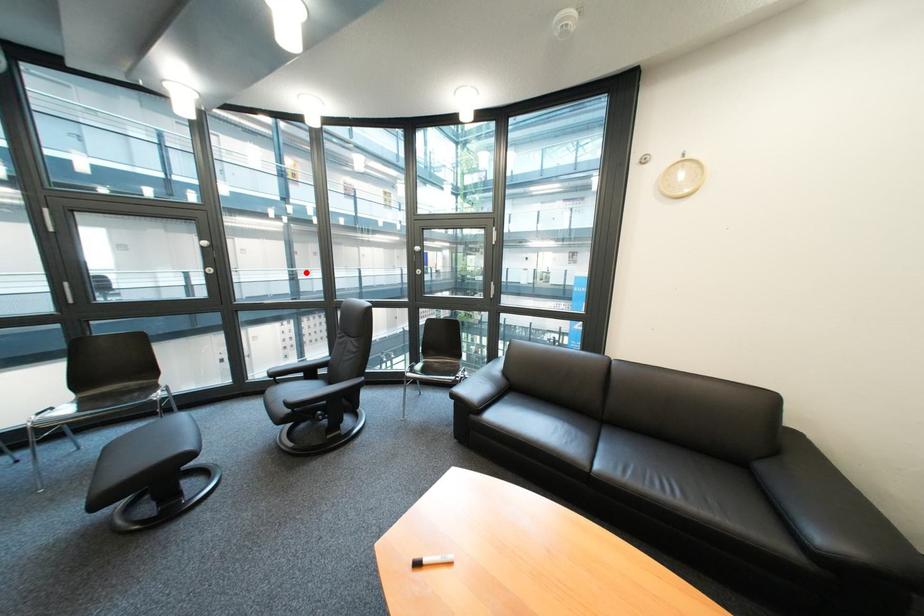
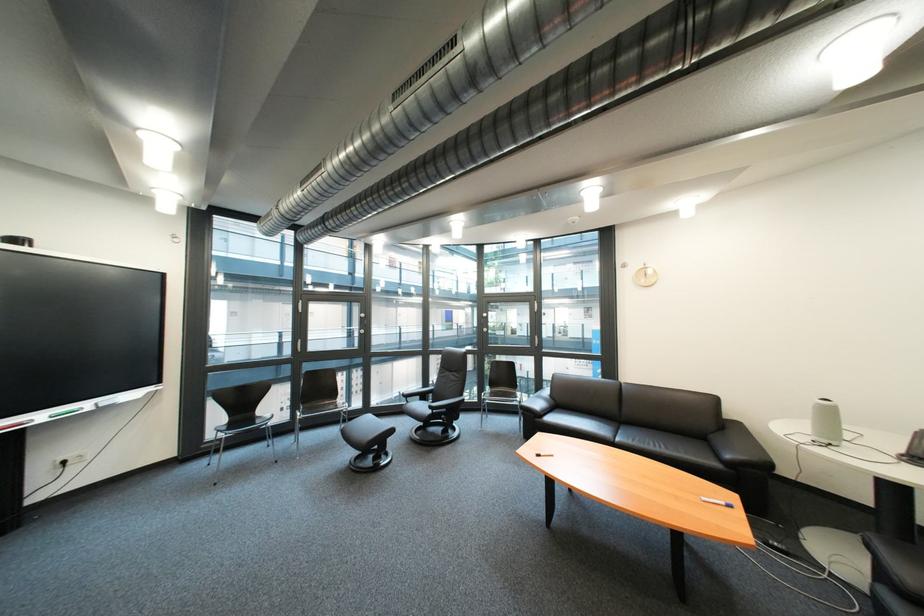
Question: I am providing you with two images of the same scene from different viewpoints. Given a red point in image1, look at the same physical point in image2. Is it:

Choices:
 (A) Closer to the viewpoint
 (B) Farther from the viewpoint

Answer: (A)